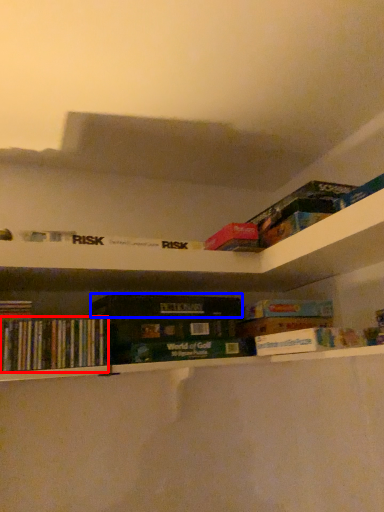
Question: Among these objects, which one is farthest to the camera, book (highlighted by a red box) or paperback book (highlighted by a blue box)?

Choices:
 (A) book
 (B) paperback book

Answer: (B)